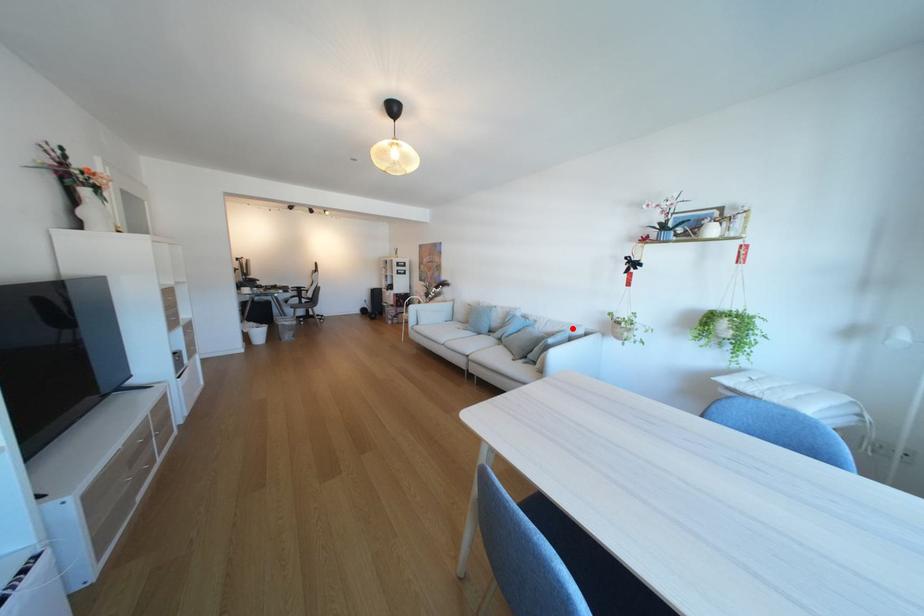
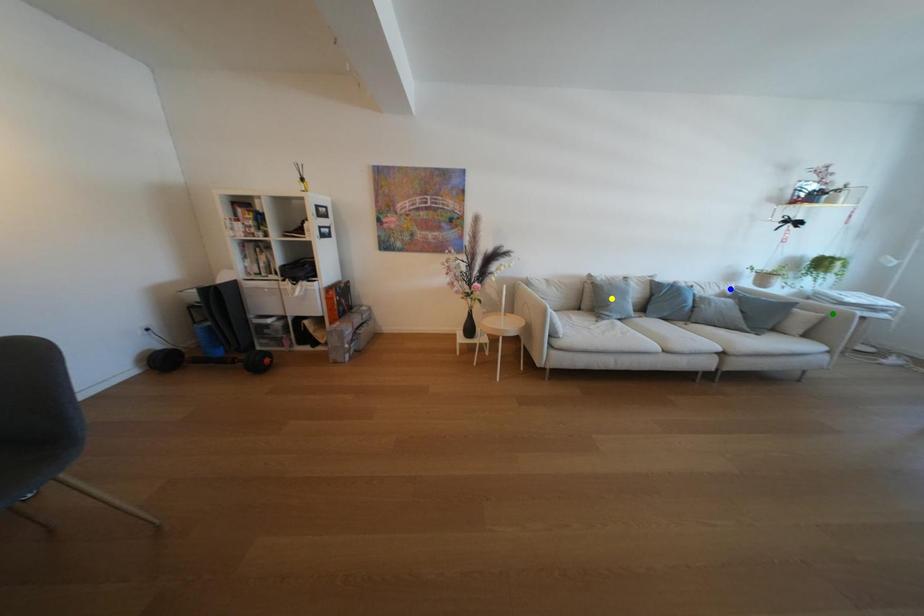
Question: I am providing you with two images of the same scene from different viewpoints. A red point is marked on the first image. You are given multiple points on the second image. Can you choose the point in image 2 that corresponds to the point in image 1?

Choices:
 (A) yellow point
 (B) blue point
 (C) green point

Answer: (B)